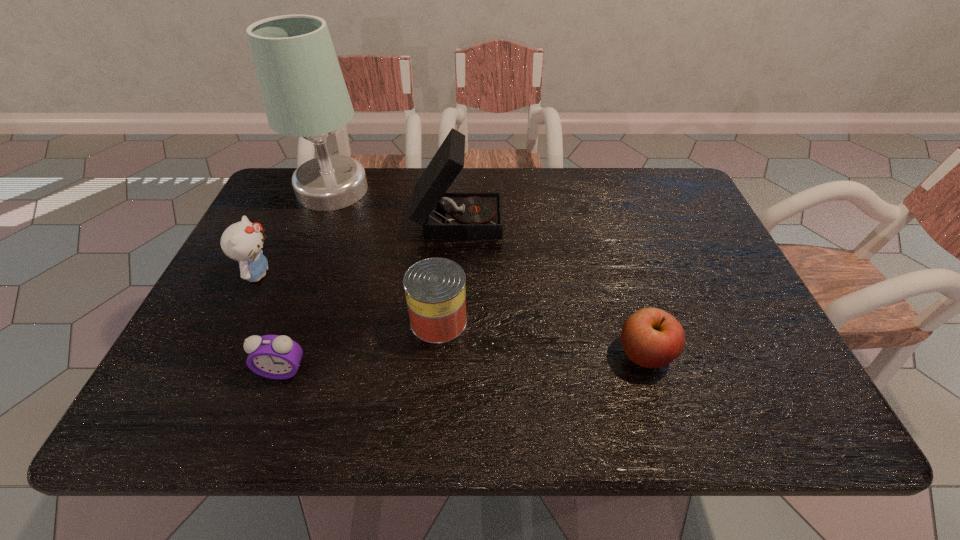
Where is `vacant area between the phonograph_record and the third farthest object`? vacant area between the phonograph_record and the third farthest object is located at coordinates point(358,246).

Locate an element on the screen. This screenshot has width=960, height=540. the fourth closest object to the rightmost object is located at coordinates (304, 93).

Identify which object is located as the fifth nearest to the alarm clock. Please provide its 2D coordinates. Your answer should be formatted as a tuple, i.e. [(x, y)], where the tuple contains the x and y coordinates of a point satisfying the conditions above.

[(652, 338)]

Locate an element on the screen. The height and width of the screenshot is (540, 960). free location that satisfies the following two spatial constraints: 1. on the base of the tallest object; 2. on the left side of the apple is located at coordinates (267, 353).

Locate an element on the screen. vacant region that satisfies the following two spatial constraints: 1. on the front-facing side of the third farthest object; 2. on the back side of the apple is located at coordinates (220, 353).

Find the location of a particular element. This screenshot has width=960, height=540. free space that satisfies the following two spatial constraints: 1. on the front-facing side of the third farthest object; 2. on the right side of the can is located at coordinates (236, 321).

At what (x,y) coordinates should I click in order to perform the action: click on free space in the image that satisfies the following two spatial constraints: 1. on the base of the tallest object; 2. on the front-facing side of the kitten. Please return your answer as a coordinate pair (x, y). The height and width of the screenshot is (540, 960). Looking at the image, I should click on (299, 274).

At what (x,y) coordinates should I click in order to perform the action: click on vacant space that satisfies the following two spatial constraints: 1. on the base of the lampshade; 2. on the right side of the can. Please return your answer as a coordinate pair (x, y). Image resolution: width=960 pixels, height=540 pixels. Looking at the image, I should click on (280, 321).

The height and width of the screenshot is (540, 960). I want to click on free space that satisfies the following two spatial constraints: 1. on the base of the tallest object; 2. on the front-facing side of the third farthest object, so click(x=299, y=274).

Where is `free space that satisfies the following two spatial constraints: 1. on the front-facing side of the rightmost object; 2. on the right side of the third farthest object`? The height and width of the screenshot is (540, 960). free space that satisfies the following two spatial constraints: 1. on the front-facing side of the rightmost object; 2. on the right side of the third farthest object is located at coordinates (220, 353).